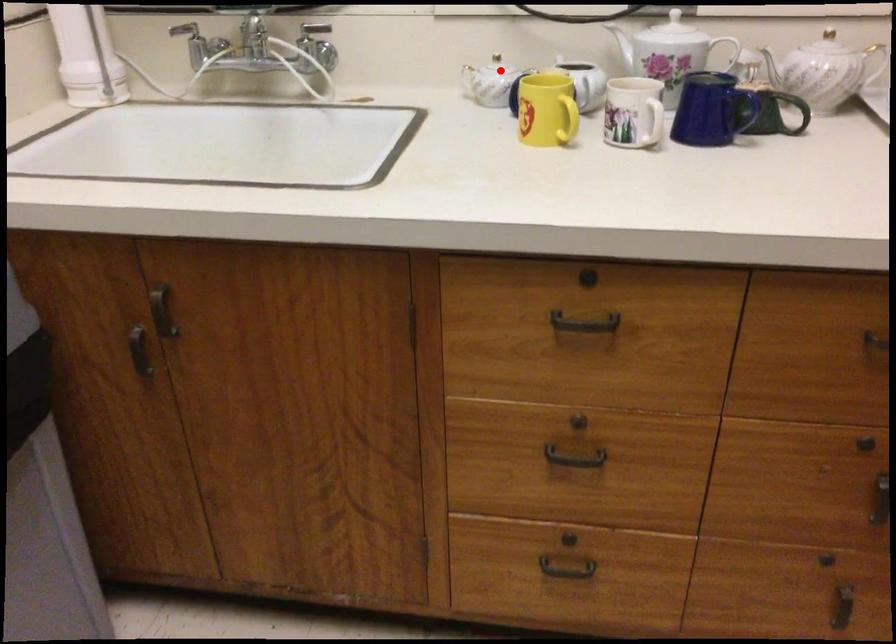
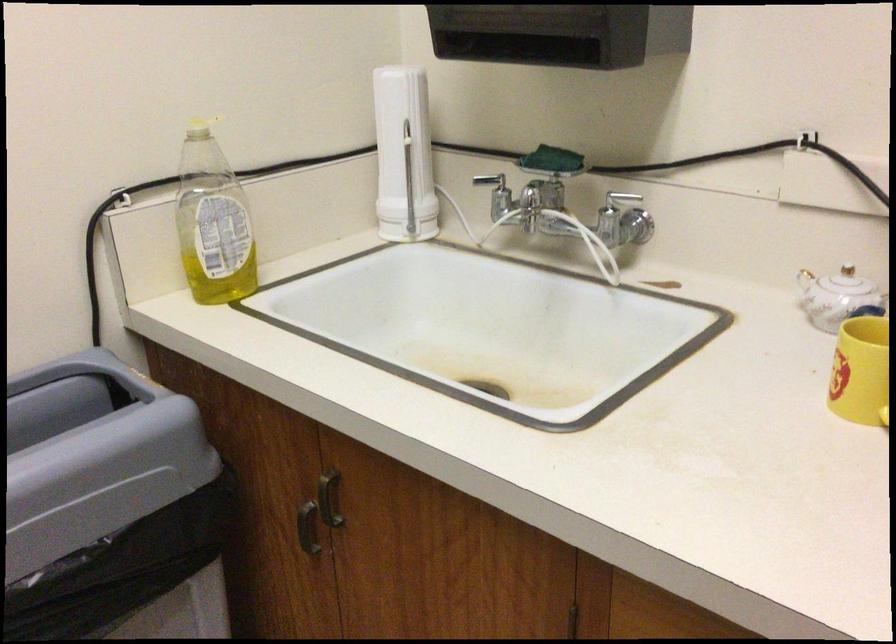
The point at the highlighted location is marked in the first image. Where is the corresponding point in the second image?

(848, 287)